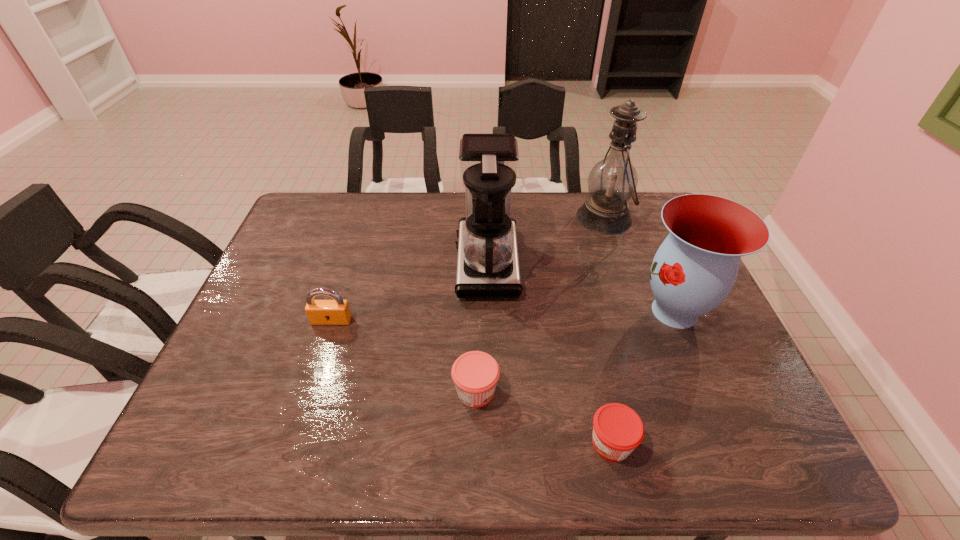
Image resolution: width=960 pixels, height=540 pixels. Identify the location of oil lamp. (611, 183).

This screenshot has width=960, height=540. Find the location of `coffee maker`. coffee maker is located at coordinates (488, 264).

Locate an element on the screen. the fourth shortest object is located at coordinates (695, 268).

The height and width of the screenshot is (540, 960). What are the coordinates of `the leftmost object` in the screenshot? It's located at (319, 312).

Identify the location of padlock. The height and width of the screenshot is (540, 960). (319, 312).

The height and width of the screenshot is (540, 960). Find the location of `the left jam`. the left jam is located at coordinates (475, 374).

Locate an element on the screen. Image resolution: width=960 pixels, height=540 pixels. the farther jam is located at coordinates (475, 374).

The height and width of the screenshot is (540, 960). What are the coordinates of `the nearer jam` in the screenshot? It's located at (617, 429).

This screenshot has height=540, width=960. Find the location of `the right jam`. the right jam is located at coordinates (617, 429).

Identify the location of vacant area situated 0.190m on the left of the oil lamp. (518, 218).